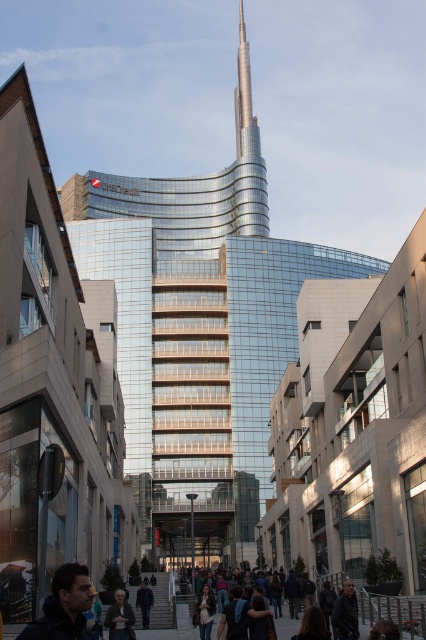
You are a photographer standing on the sidewalk. You see the gold metallic spire at center and the dark gray jacket at center. Which object is wider?

The gold metallic spire at center is wider than the dark gray jacket at center.

You are standing on the sidewalk in front of the tall, sleek building with a curved facade. You want to take a photo of the UniCredit logo on the upper left corner of the building. To do this, you need to position yourself so that the logo is centered in your camera viewfinder. Given that the building is represented by the point at point (198, 337), where should you aim your camera to capture the logo?

The glassy metallic tower at center is represented by point (198, 337). To capture the UniCredit logo on the upper left corner, you should aim your camera slightly to the upper left of the point (198, 337) since the logo is located on the upper left part of the building.